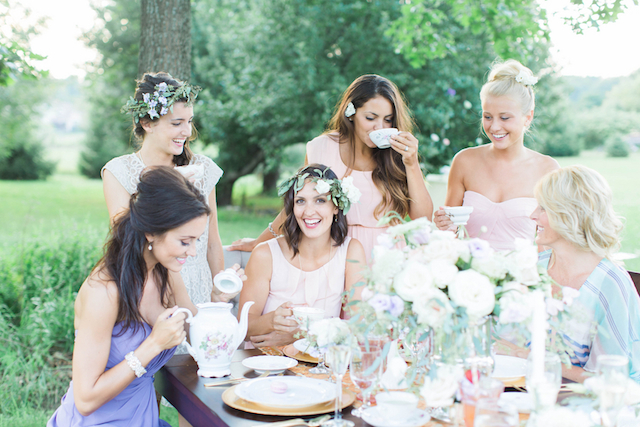
Locate an element on the screen. glass is located at coordinates (337, 358), (361, 374), (413, 354), (458, 347), (486, 369), (486, 402), (555, 387), (614, 384), (381, 339).